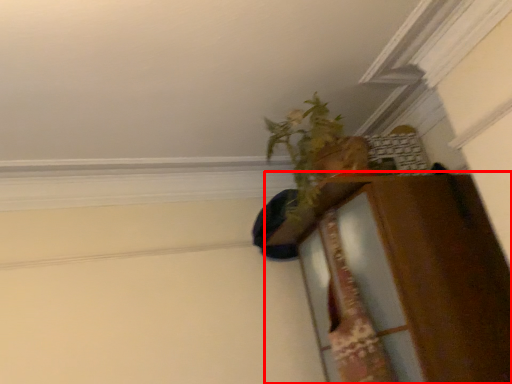
Question: Where is dresser (annotated by the red box) located in relation to houseplant in the image?

Choices:
 (A) left
 (B) right

Answer: (B)